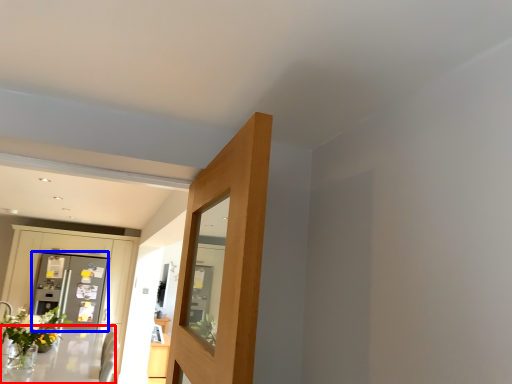
Question: Which point is closer to the camera, table (highlighted by a red box) or screen door (highlighted by a blue box)?

Choices:
 (A) table
 (B) screen door

Answer: (A)